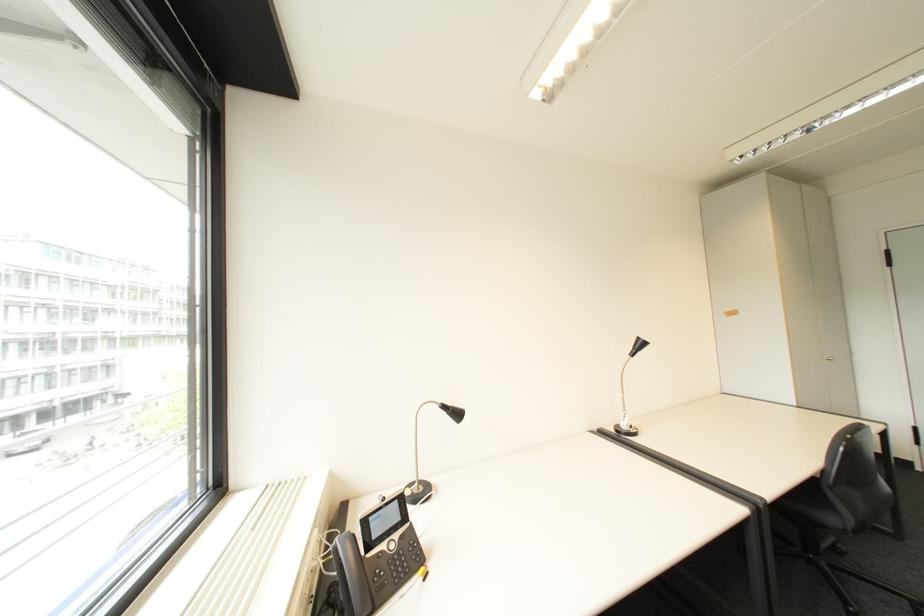
Where would you pull the silver cabinet handle? Please return your answer as a coordinate pair (x, y).

(829, 359)